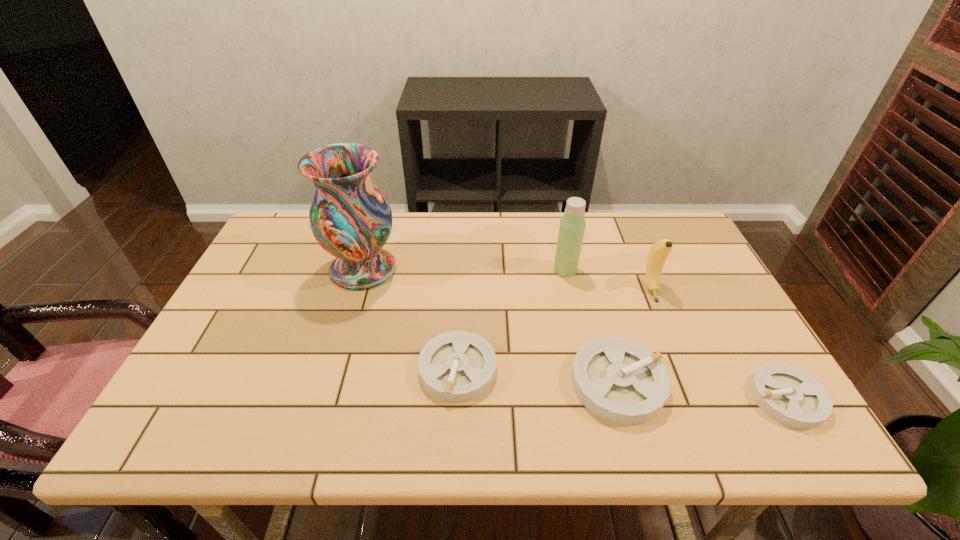
I want to click on the fifth object from right to left, so click(x=457, y=366).

The height and width of the screenshot is (540, 960). In order to click on the second shortest ashtray in this screenshot , I will do `click(457, 366)`.

The width and height of the screenshot is (960, 540). I want to click on the second ashtray from left to right, so click(621, 381).

You are a GUI agent. You are given a task and a screenshot of the screen. Output one action in this format:
    pyautogui.click(x=<x>, y=<y>)
    Task: Click on the rightmost ashtray
    The width and height of the screenshot is (960, 540).
    Given the screenshot: What is the action you would take?
    pyautogui.click(x=789, y=395)

Find the location of `the shortest ashtray`. the shortest ashtray is located at coordinates (789, 395).

Locate an element on the screen. Image resolution: width=960 pixels, height=540 pixels. the second tallest object is located at coordinates (572, 226).

I want to click on the tallest object, so click(x=351, y=219).

I want to click on the leftmost object, so click(x=351, y=219).

The height and width of the screenshot is (540, 960). I want to click on banana, so click(x=658, y=253).

Identify the location of the third tallest object. (658, 253).